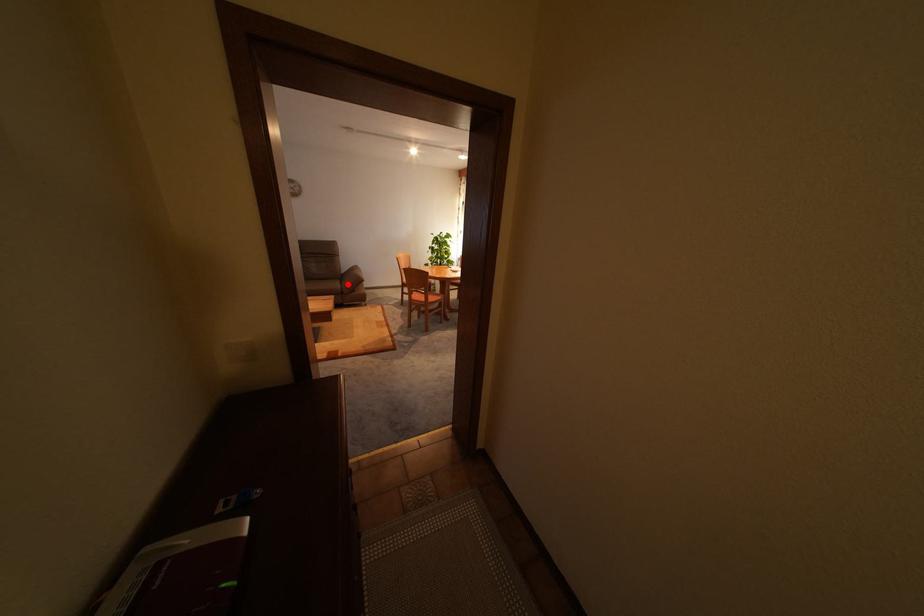
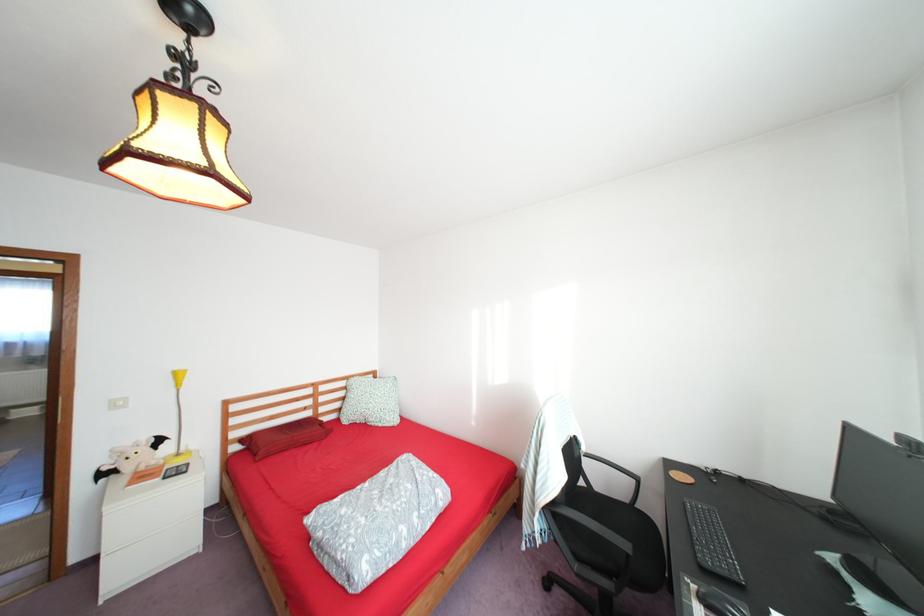
Question: I am providing you with two images of the same scene from different viewpoints. A red point is marked on the first image. At the location where the point appears in image 1, is it still visible in image 2?

Choices:
 (A) Yes
 (B) No

Answer: (B)